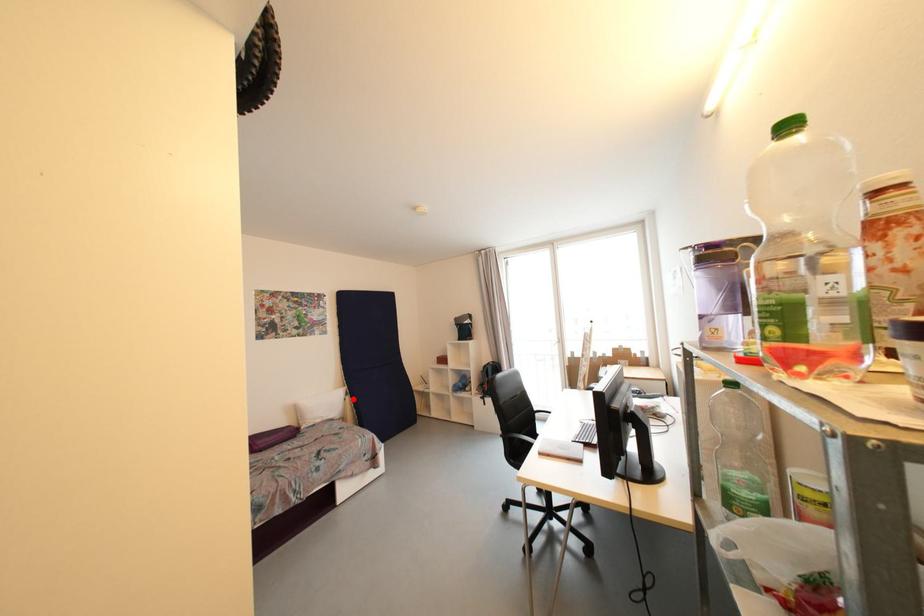
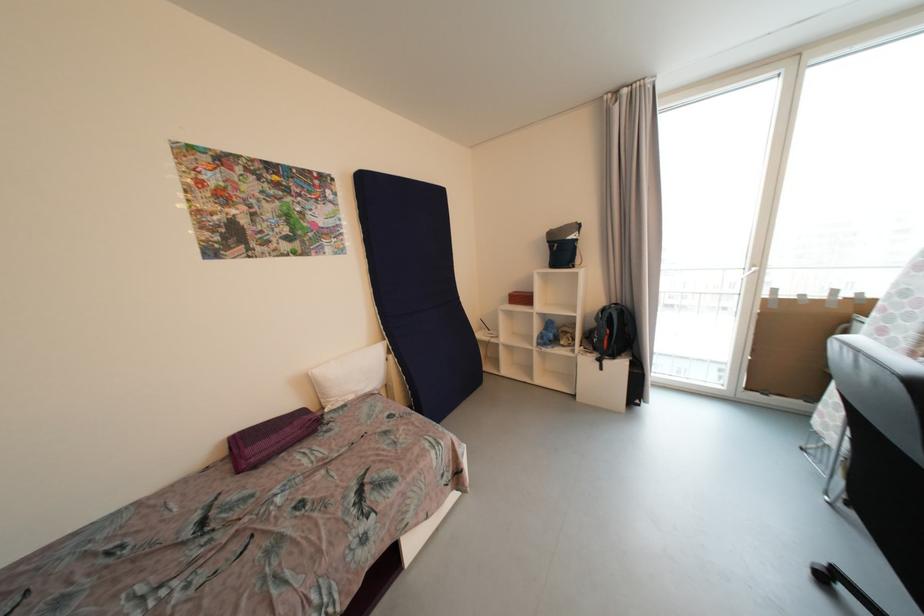
The point at the highlighted location is marked in the first image. Where is the corresponding point in the second image?

(396, 359)